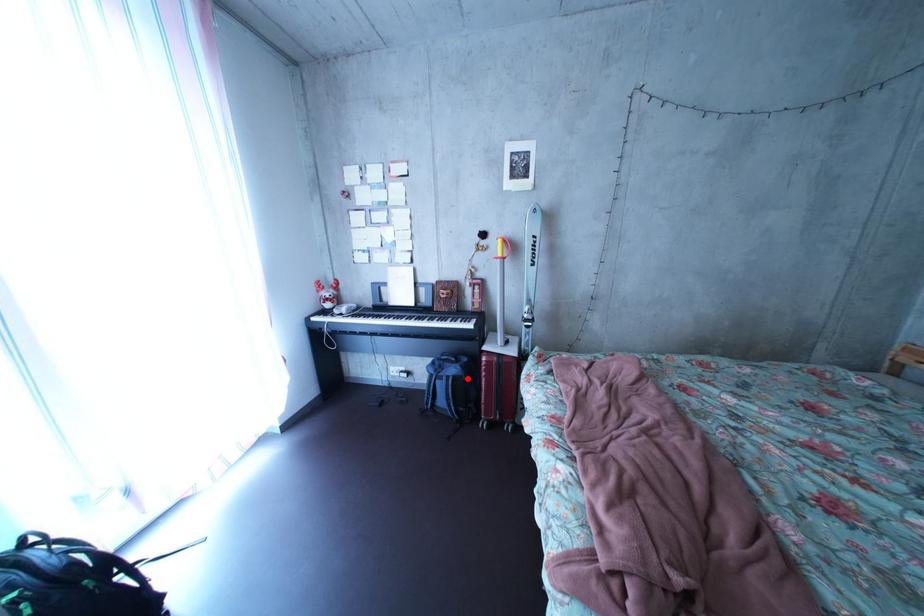
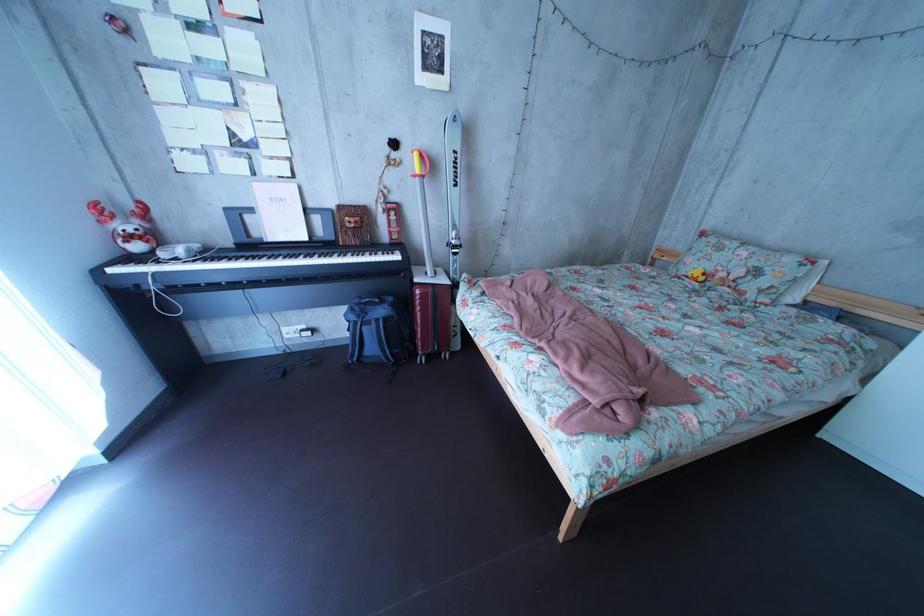
Where in the second image is the point corresponding to the highlighted location from the first image?

(395, 320)